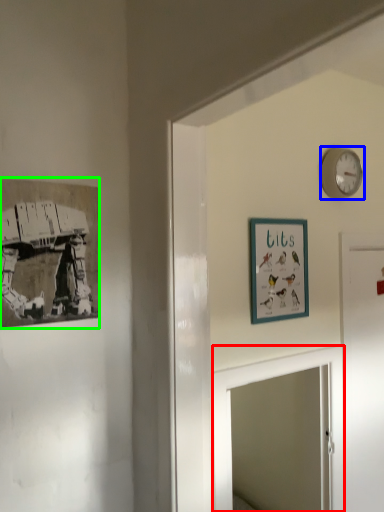
Question: Based on their relative distances, which object is farther from mirror (highlighted by a red box)? Choose from wall clock (highlighted by a blue box) and picture frame (highlighted by a green box).

Choices:
 (A) wall clock
 (B) picture frame

Answer: (A)